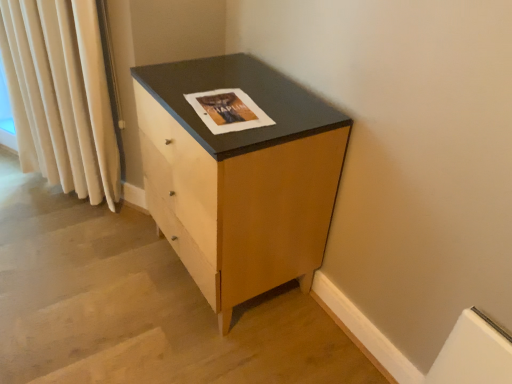
Locate an element on the screen. The height and width of the screenshot is (384, 512). vacant region to the left of cream velvet curtain at left is located at coordinates (34, 206).